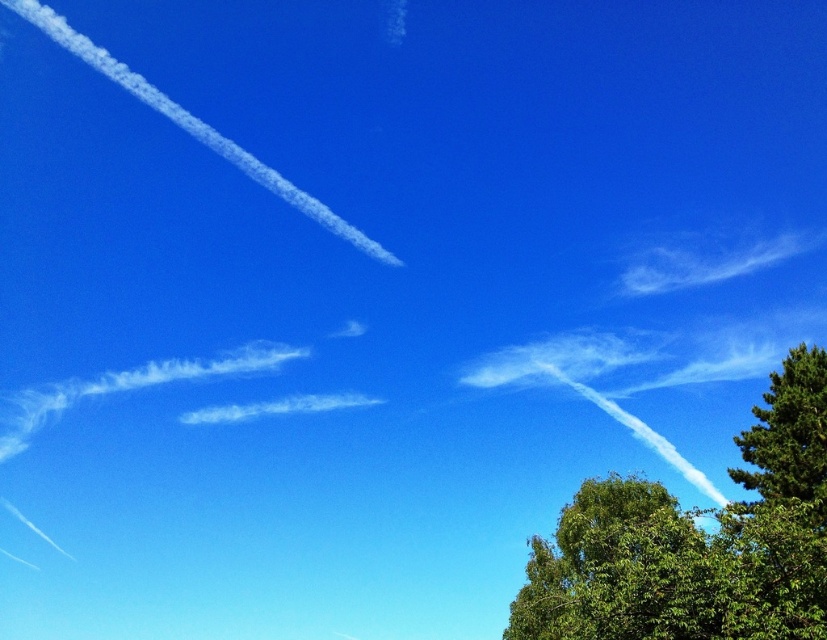
The image size is (827, 640). What do you see at coordinates (696, 541) in the screenshot?
I see `green leafy tree at right` at bounding box center [696, 541].

Does point (715, 632) come farther from viewer compared to point (517, 605)?

No, (715, 632) is in front of (517, 605).

Identify the location of green leafy tree at right. (696, 541).